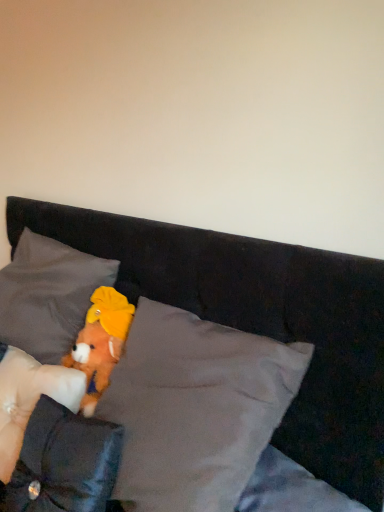
What is the approximate width of fluffy orange teddy bear at center?

The width of fluffy orange teddy bear at center is 6.92 inches.

The width and height of the screenshot is (384, 512). What do you see at coordinates (48, 295) in the screenshot?
I see `dark gray plush pillow at left, the 3th pillow in the front-to-back sequence` at bounding box center [48, 295].

Describe the element at coordinates (30, 399) in the screenshot. I see `soft white pillow at lower left, the 2th pillow viewed from the front` at that location.

Consider the image. In order to face soft white pillow at lower left, marked as the second pillow in a back-to-front arrangement, should I rotate leftwards or rightwards?

Turn left approximately 22.905 degrees to face it.

Describe the element at coordinates (64, 464) in the screenshot. I see `velvet gray pillow at lower left, the 1th pillow when ordered from front to back` at that location.

Find the location of a particular element. This screenshot has height=512, width=384. fluffy fabric stuffed animal at center is located at coordinates (260, 320).

Locate an element on the screen. teddy bear above the soft white pillow at lower left, marked as the second pillow in a back-to-front arrangement (from a real-world perspective) is located at coordinates (100, 343).

Considering the relative sizes of soft white pillow at lower left, the 2th pillow viewed from the front, and fluffy orange teddy bear at center in the image provided, is soft white pillow at lower left, the 2th pillow viewed from the front, bigger than fluffy orange teddy bear at center?

Indeed, soft white pillow at lower left, the 2th pillow viewed from the front, has a larger size compared to fluffy orange teddy bear at center.

Does point (81, 297) appear closer or farther from the camera than point (85, 462)?

Point (81, 297) appears to be farther away from the viewer than point (85, 462).

From the picture: Can you confirm if dark gray plush pillow at left, the 3th pillow in the front-to-back sequence, is smaller than velvet gray pillow at lower left, placed as the 3th pillow when sorted from back to front?

No.

Is dark gray plush pillow at left, which is the first pillow from back to front, facing towards velvet gray pillow at lower left, the 1th pillow when ordered from front to back?

No.

Looking at this image, from the image's perspective, is dark gray plush pillow at left, which is the first pillow from back to front, over velvet gray pillow at lower left, placed as the 3th pillow when sorted from back to front?

Indeed, from the image's perspective, dark gray plush pillow at left, which is the first pillow from back to front, is shown above velvet gray pillow at lower left, placed as the 3th pillow when sorted from back to front.

From the picture: Are fluffy fabric stuffed animal at center and velvet gray pillow at lower left, the 1th pillow when ordered from front to back, making contact?

No, fluffy fabric stuffed animal at center is not with velvet gray pillow at lower left, the 1th pillow when ordered from front to back.

How much distance is there between fluffy fabric stuffed animal at center and velvet gray pillow at lower left, the 1th pillow when ordered from front to back?

The distance of fluffy fabric stuffed animal at center from velvet gray pillow at lower left, the 1th pillow when ordered from front to back, is 16.15 inches.

Between point (357, 356) and point (46, 490), which one is positioned in front?

The point (357, 356) is closer.

In terms of width, does soft white pillow at lower left, marked as the second pillow in a back-to-front arrangement, look wider or thinner when compared to dark gray plush pillow at left, the 3th pillow in the front-to-back sequence?

In the image, soft white pillow at lower left, marked as the second pillow in a back-to-front arrangement, appears to be more narrow than dark gray plush pillow at left, the 3th pillow in the front-to-back sequence.

From the image's perspective, is soft white pillow at lower left, marked as the second pillow in a back-to-front arrangement, below dark gray plush pillow at left, the 3th pillow in the front-to-back sequence?

Indeed, from the image's perspective, soft white pillow at lower left, marked as the second pillow in a back-to-front arrangement, is shown beneath dark gray plush pillow at left, the 3th pillow in the front-to-back sequence.

I want to click on pillow that is the 1st object located below the dark gray plush pillow at left, the 3th pillow in the front-to-back sequence (from the image's perspective), so click(x=30, y=399).

What's the angular difference between soft white pillow at lower left, the 2th pillow viewed from the front, and dark gray plush pillow at left, the 3th pillow in the front-to-back sequence,'s facing directions?

The angle between the facing direction of soft white pillow at lower left, the 2th pillow viewed from the front, and the facing direction of dark gray plush pillow at left, the 3th pillow in the front-to-back sequence, is 11.8 degrees.

Could you tell me if velvet gray pillow at lower left, the 1th pillow when ordered from front to back, is turned towards fluffy fabric stuffed animal at center?

Yes.

From the image's perspective, would you say velvet gray pillow at lower left, the 1th pillow when ordered from front to back, is positioned over fluffy fabric stuffed animal at center?

Actually, velvet gray pillow at lower left, the 1th pillow when ordered from front to back, appears below fluffy fabric stuffed animal at center in the image.

Which is behind, velvet gray pillow at lower left, the 1th pillow when ordered from front to back, or fluffy fabric stuffed animal at center?

velvet gray pillow at lower left, the 1th pillow when ordered from front to back, is behind.

Is dark gray plush pillow at left, which is the first pillow from back to front, positioned far away from soft white pillow at lower left, the 2th pillow viewed from the front?

dark gray plush pillow at left, which is the first pillow from back to front, is actually quite close to soft white pillow at lower left, the 2th pillow viewed from the front.

In the scene shown: Does dark gray plush pillow at left, the 3th pillow in the front-to-back sequence, have a larger size compared to soft white pillow at lower left, the 2th pillow viewed from the front?

Correct, dark gray plush pillow at left, the 3th pillow in the front-to-back sequence, is larger in size than soft white pillow at lower left, the 2th pillow viewed from the front.

Does point (52, 343) come behind point (7, 421)?

Yes, it is behind point (7, 421).

Can you confirm if dark gray plush pillow at left, which is the first pillow from back to front, is wider than soft white pillow at lower left, marked as the second pillow in a back-to-front arrangement?

Yes, dark gray plush pillow at left, which is the first pillow from back to front, is wider than soft white pillow at lower left, marked as the second pillow in a back-to-front arrangement.

From the picture: From their relative heights in the image, would you say fluffy fabric stuffed animal at center is taller or shorter than soft white pillow at lower left, marked as the second pillow in a back-to-front arrangement?

Clearly, fluffy fabric stuffed animal at center is taller compared to soft white pillow at lower left, marked as the second pillow in a back-to-front arrangement.

Which of these two, fluffy fabric stuffed animal at center or soft white pillow at lower left, the 2th pillow viewed from the front, is thinner?

With smaller width is soft white pillow at lower left, the 2th pillow viewed from the front.

Image resolution: width=384 pixels, height=512 pixels. In the image, there is a soft white pillow at lower left, marked as the second pillow in a back-to-front arrangement. Identify the location of bed above it (from the image's perspective). (260, 320).

Where is `teddy bear on the right of soft white pillow at lower left, the 2th pillow viewed from the front`? Image resolution: width=384 pixels, height=512 pixels. teddy bear on the right of soft white pillow at lower left, the 2th pillow viewed from the front is located at coordinates (100, 343).

The image size is (384, 512). What are the coordinates of `the 2nd pillow below the dark gray plush pillow at left, which is the first pillow from back to front (from the image's perspective)` in the screenshot? It's located at click(64, 464).

From the image, which object appears to be nearer to dark gray plush pillow at left, the 3th pillow in the front-to-back sequence, fluffy fabric stuffed animal at center or velvet gray pillow at lower left, the 1th pillow when ordered from front to back?

fluffy fabric stuffed animal at center lies closer to dark gray plush pillow at left, the 3th pillow in the front-to-back sequence, than the other object.

Looking at this image, looking at the image, which one is located closer to dark gray plush pillow at left, the 3th pillow in the front-to-back sequence, fluffy orange teddy bear at center or soft white pillow at lower left, the 2th pillow viewed from the front?

Based on the image, fluffy orange teddy bear at center appears to be nearer to dark gray plush pillow at left, the 3th pillow in the front-to-back sequence.

From the image, which object appears to be farther from fluffy orange teddy bear at center, fluffy fabric stuffed animal at center or velvet gray pillow at lower left, placed as the 3th pillow when sorted from back to front?

fluffy fabric stuffed animal at center is positioned further to the anchor fluffy orange teddy bear at center.

Based on their spatial positions, is soft white pillow at lower left, marked as the second pillow in a back-to-front arrangement, or fluffy orange teddy bear at center closer to fluffy fabric stuffed animal at center?

fluffy orange teddy bear at center is positioned closer to the anchor fluffy fabric stuffed animal at center.

Looking at the image, which one is located closer to fluffy fabric stuffed animal at center, soft white pillow at lower left, marked as the second pillow in a back-to-front arrangement, or dark gray plush pillow at left, which is the first pillow from back to front?

Among the two, dark gray plush pillow at left, which is the first pillow from back to front, is located nearer to fluffy fabric stuffed animal at center.

Which object lies nearer to the anchor point fluffy fabric stuffed animal at center, fluffy orange teddy bear at center or velvet gray pillow at lower left, the 1th pillow when ordered from front to back?

Among the two, fluffy orange teddy bear at center is located nearer to fluffy fabric stuffed animal at center.

Based on their spatial positions, is fluffy fabric stuffed animal at center or fluffy orange teddy bear at center closer to velvet gray pillow at lower left, placed as the 3th pillow when sorted from back to front?

fluffy orange teddy bear at center is positioned closer to the anchor velvet gray pillow at lower left, placed as the 3th pillow when sorted from back to front.

Estimate the real-world distances between objects in this image. Which object is further from velvet gray pillow at lower left, placed as the 3th pillow when sorted from back to front, fluffy fabric stuffed animal at center or soft white pillow at lower left, marked as the second pillow in a back-to-front arrangement?

fluffy fabric stuffed animal at center lies further to velvet gray pillow at lower left, placed as the 3th pillow when sorted from back to front, than the other object.

In order to click on teddy bear between dark gray plush pillow at left, which is the first pillow from back to front, and soft white pillow at lower left, the 2th pillow viewed from the front, in the up-down direction in this screenshot , I will do `click(100, 343)`.

Locate an element on the screen. pillow between dark gray plush pillow at left, the 3th pillow in the front-to-back sequence, and velvet gray pillow at lower left, placed as the 3th pillow when sorted from back to front, in the vertical direction is located at coordinates (30, 399).

This screenshot has height=512, width=384. I want to click on teddy bear between fluffy fabric stuffed animal at center and dark gray plush pillow at left, the 3th pillow in the front-to-back sequence, in the front-back direction, so coord(100,343).

Find the location of `pillow between velvet gray pillow at lower left, the 1th pillow when ordered from front to back, and fluffy orange teddy bear at center in the front-back direction`. pillow between velvet gray pillow at lower left, the 1th pillow when ordered from front to back, and fluffy orange teddy bear at center in the front-back direction is located at coordinates (30, 399).